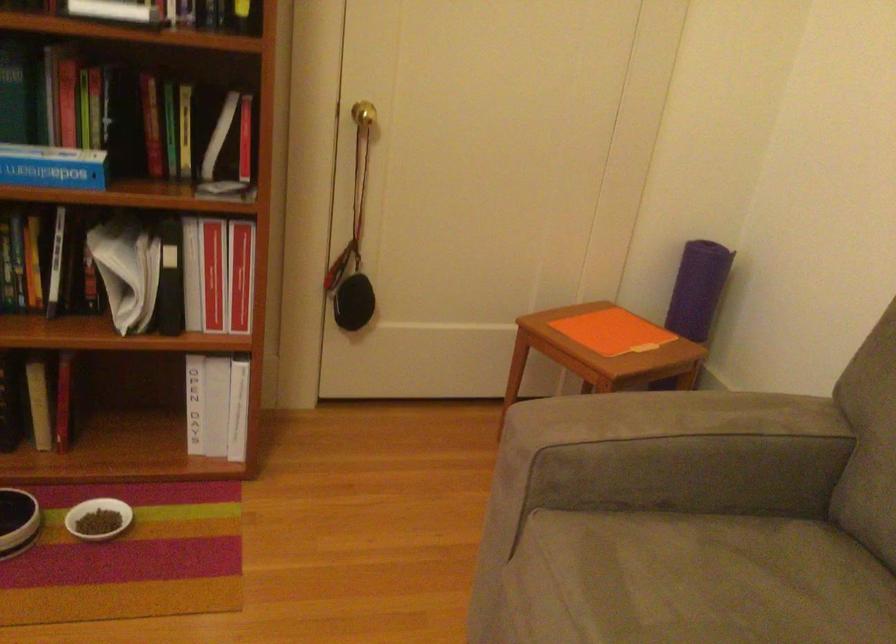
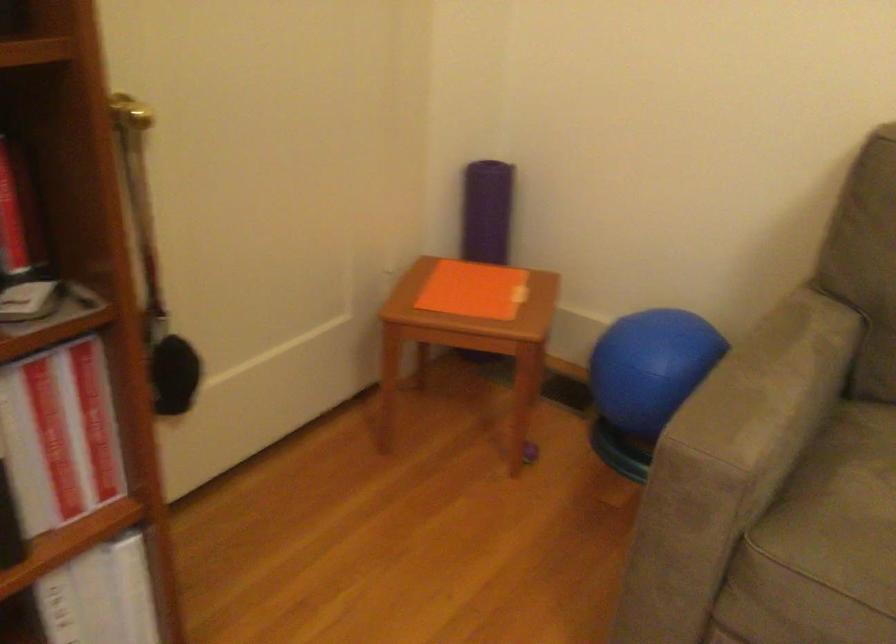
Question: The camera is either moving clockwise (left) or counter-clockwise (right) around the object. The first image is from the beginning of the video and the second image is from the end. Is the camera moving left or right when shooting the video?

Choices:
 (A) Left
 (B) Right

Answer: (A)